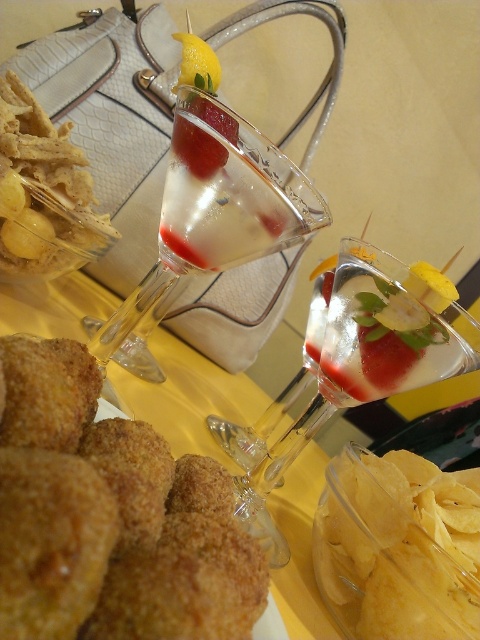
You are a food delivery person who needs to place a small container between the golden crispy chips at lower right and the golden fried nuggets at lower left. Which side should you place it closer to?

The golden crispy chips at lower right is smaller than the golden fried nuggets at lower left, so you should place the container closer to the golden crispy chips at lower right to ensure enough space.

You are a food delivery robot with a 10 inch wide tray. You need to carry both the translucent glass cocktail at center and the golden fried nuggets at lower left. Can you place both items on your tray without overlapping?

The distance between the translucent glass cocktail at center and the golden fried nuggets at lower left is 8.98 inches, which is less than the 10 inch width of your tray. Therefore, you can place both items on your tray without overlapping.